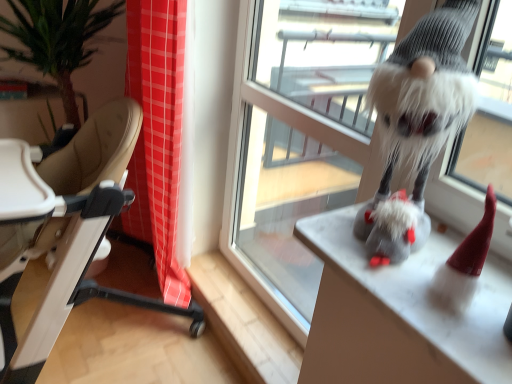
In order to click on blank space situated above fuzzy gray gnome at right (from a real-world perspective) in this screenshot , I will do `click(432, 266)`.